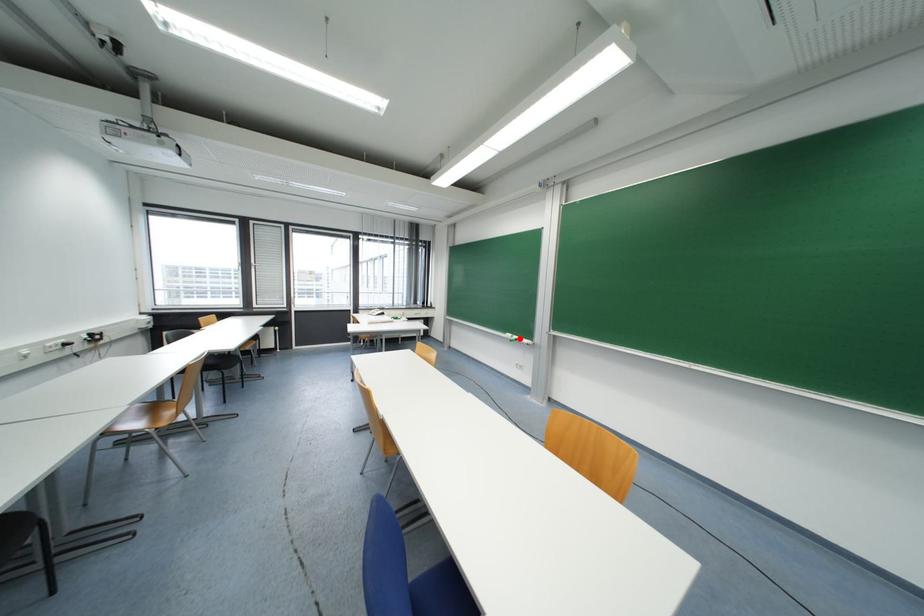
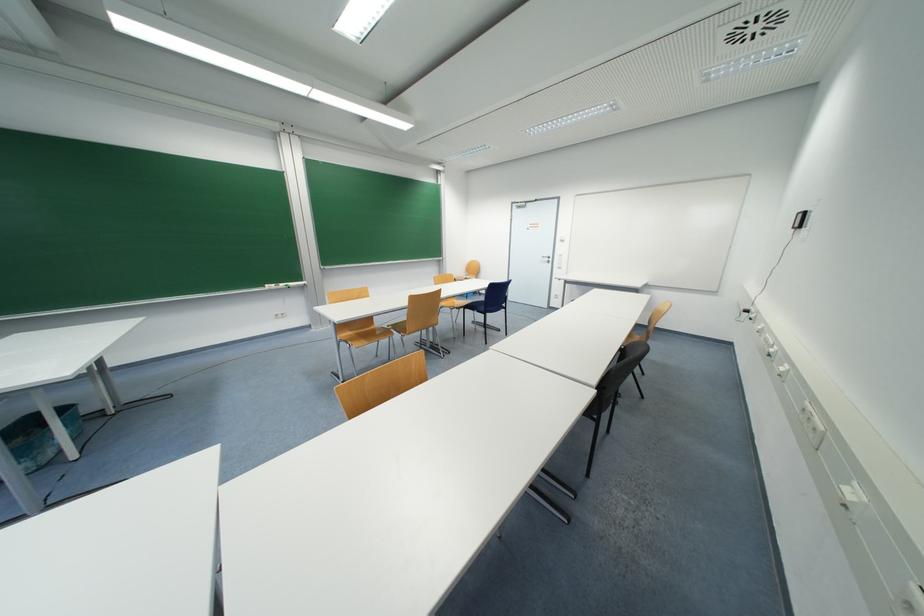
In the second image, find the point that corresponds to the highlighted location in the first image.

(286, 286)